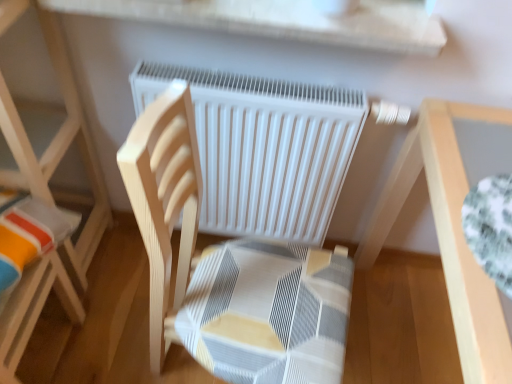
The height and width of the screenshot is (384, 512). What do you see at coordinates (264, 148) in the screenshot?
I see `white matte radiator at center` at bounding box center [264, 148].

Measure the distance between light wood table at right and camera.

light wood table at right is 63.00 centimeters away from camera.

This screenshot has height=384, width=512. What are the coordinates of `wooden chair at center` in the screenshot? It's located at (229, 270).

Image resolution: width=512 pixels, height=384 pixels. What are the coordinates of `white matte radiator at center` in the screenshot? It's located at 264,148.

Who is bigger, light wood table at right or light wood chair at left?

light wood table at right is bigger.

Is light wood table at right with light wood chair at left?

There is a gap between light wood table at right and light wood chair at left.

Is light wood table at right positioned beyond the bounds of light wood chair at left?

Indeed, light wood table at right is completely outside light wood chair at left.

From a real-world perspective, is light wood table at right positioned above or below light wood chair at left?

Clearly, from a real-world perspective, light wood table at right is below light wood chair at left.

Does white matte radiator at center appear on the right side of light wood table at right?

Incorrect, white matte radiator at center is not on the right side of light wood table at right.

Is white matte radiator at center inside or outside of light wood table at right?

white matte radiator at center lies outside light wood table at right.

Identify the location of radiator that is on the left side of light wood table at right. (264, 148).

Does white matte radiator at center touch light wood table at right?

No, white matte radiator at center is not next to light wood table at right.

Is light wood chair at left wider than light wood table at right?

No, light wood chair at left is not wider than light wood table at right.

Image resolution: width=512 pixels, height=384 pixels. Find the location of `furniture located above the light wood table at right (from the image's perspective)`. furniture located above the light wood table at right (from the image's perspective) is located at coordinates (48, 196).

Which is more to the left, light wood chair at left or light wood table at right?

light wood chair at left.

From the image's perspective, is light wood chair at left above or below light wood table at right?

light wood chair at left is above light wood table at right.

Looking at this image, from a real-world perspective, is light wood table at right on top of wooden chair at center?

No, from a real-world perspective, light wood table at right is not on top of wooden chair at center.

Is light wood table at right turned away from wooden chair at center?

No, light wood table at right's orientation is not away from wooden chair at center.

Is light wood table at right thinner than wooden chair at center?

No, light wood table at right is not thinner than wooden chair at center.

Measure the distance from light wood table at right to wooden chair at center.

light wood table at right is 17.78 inches away from wooden chair at center.

Considering the sizes of objects wooden chair at center and light wood chair at left in the image provided, who is bigger, wooden chair at center or light wood chair at left?

With larger size is wooden chair at center.

Can you confirm if wooden chair at center is thinner than light wood chair at left?

No, wooden chair at center is not thinner than light wood chair at left.

Considering the relative sizes of wooden chair at center and light wood chair at left in the image provided, is wooden chair at center shorter than light wood chair at left?

Yes.

From the image's perspective, which object appears higher, wooden chair at center or light wood chair at left?

light wood chair at left appears higher in the image.

Does point (324, 218) lie in front of point (327, 344)?

That is False.

Find the location of `chair lying in front of the white matte radiator at center`. chair lying in front of the white matte radiator at center is located at coordinates (229, 270).

Considering the relative positions of white matte radiator at center and wooden chair at center in the image provided, is white matte radiator at center to the right of wooden chair at center from the viewer's perspective?

Correct, you'll find white matte radiator at center to the right of wooden chair at center.

Does white matte radiator at center have a greater height compared to wooden chair at center?

No, white matte radiator at center is not taller than wooden chair at center.

Find the location of a particular element. chair located in front of the white matte radiator at center is located at coordinates (229, 270).

From a real-world perspective, between wooden chair at center and white matte radiator at center, who is vertically higher?

From a 3D spatial view, wooden chair at center is above.

Is wooden chair at center oriented away from white matte radiator at center?

No, wooden chair at center's orientation is not away from white matte radiator at center.

You are a GUI agent. You are given a task and a screenshot of the screen. Output one action in this format:
    pyautogui.click(x=<x>, y=<y>)
    Task: Click on the furniture behind the light wood table at right
    The width and height of the screenshot is (512, 384).
    Given the screenshot: What is the action you would take?
    pyautogui.click(x=48, y=196)

Identify the location of table located underneath the white matte radiator at center (from a real-world perspective). (446, 233).

Consider the image. Which object lies nearer to the anchor point white matte radiator at center, light wood table at right or light wood chair at left?

light wood table at right lies closer to white matte radiator at center than the other object.

Considering their positions, is wooden chair at center positioned closer to white matte radiator at center than light wood chair at left?

wooden chair at center lies closer to white matte radiator at center than the other object.

Looking at the image, which one is located further to light wood table at right, white matte radiator at center or light wood chair at left?

light wood chair at left is positioned further to the anchor light wood table at right.

When comparing their distances from light wood chair at left, does wooden chair at center or white matte radiator at center seem closer?

wooden chair at center lies closer to light wood chair at left than the other object.

Which object lies further to the anchor point wooden chair at center, light wood chair at left or light wood table at right?

light wood chair at left is positioned further to the anchor wooden chair at center.

Which object lies further to the anchor point wooden chair at center, white matte radiator at center or light wood chair at left?

The object further to wooden chair at center is light wood chair at left.

From the image, which object appears to be farther from wooden chair at center, light wood chair at left or white matte radiator at center?

light wood chair at left.

Considering their positions, is light wood chair at left positioned further to light wood table at right than white matte radiator at center?

Based on the image, light wood chair at left appears to be further to light wood table at right.

The image size is (512, 384). Identify the location of chair situated between light wood chair at left and white matte radiator at center from left to right. (229, 270).

Locate an element on the screen. The height and width of the screenshot is (384, 512). chair located between light wood chair at left and light wood table at right in the left-right direction is located at coordinates (229, 270).

Identify the location of radiator situated between wooden chair at center and light wood table at right from left to right. (264, 148).

Locate an element on the screen. This screenshot has width=512, height=384. radiator between light wood chair at left and light wood table at right in the horizontal direction is located at coordinates (264, 148).